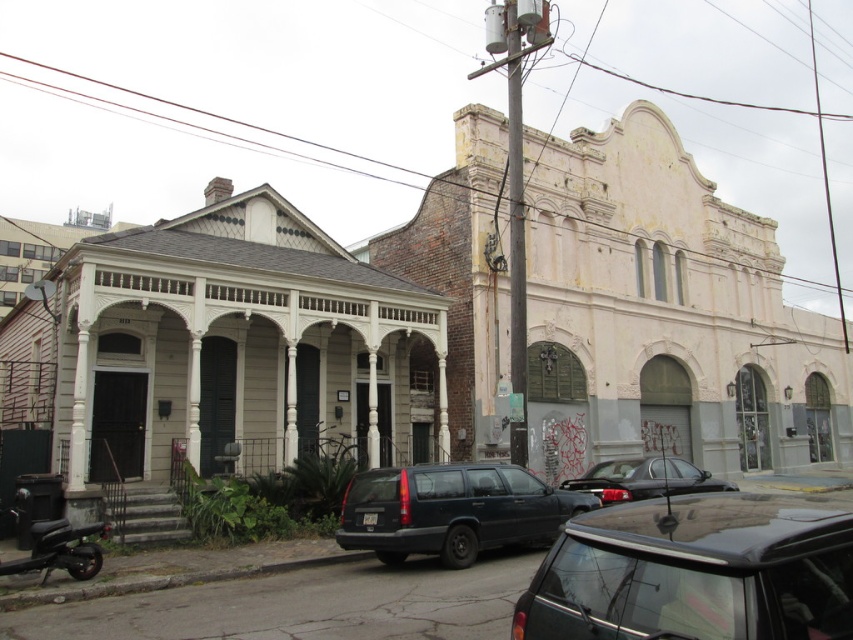
Between shiny black suv at center and matte dark blue station wagon at center, which one has more height?

Standing taller between the two is shiny black suv at center.

Who is more forward, (584,588) or (486,468)?

Positioned in front is point (584,588).

Is point (753, 634) positioned behind point (405, 531)?

No, (753, 634) is in front of (405, 531).

In order to click on shiny black suv at center in this screenshot , I will do `click(695, 572)`.

Does point (648, 508) lie in front of point (68, 552)?

Yes, point (648, 508) is closer to viewer.

Is shiny black suv at center positioned behind shiny black scooter at lower left?

No, shiny black suv at center is closer to the viewer.

Where is `shiny black suv at center`? shiny black suv at center is located at coordinates (695, 572).

Who is more forward, (674, 467) or (62, 516)?

Positioned in front is point (62, 516).

Find the location of a particular element. The image size is (853, 640). glossy black sedan at center is located at coordinates (643, 480).

The width and height of the screenshot is (853, 640). What are the coordinates of `glossy black sedan at center` in the screenshot? It's located at (643, 480).